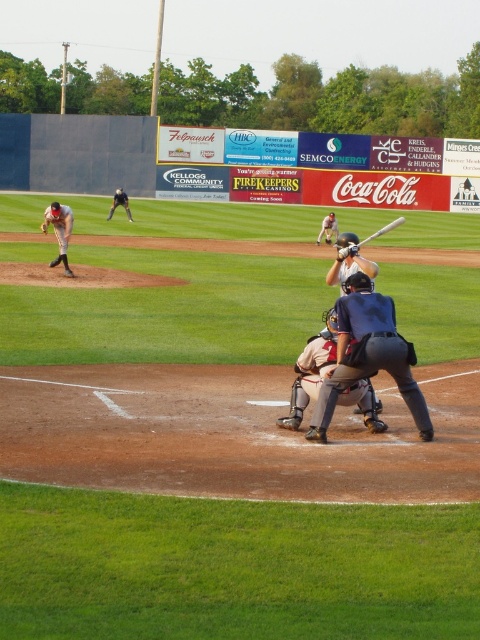
Does white leather catcher at center come in front of white uniform at left?

Yes, white leather catcher at center is in front of white uniform at left.

Locate an element on the screen. The width and height of the screenshot is (480, 640). white leather catcher at center is located at coordinates (312, 371).

The height and width of the screenshot is (640, 480). I want to click on white leather catcher at center, so click(312, 371).

Between point (331, 321) and point (350, 244), which one is positioned behind?

The point (350, 244) is more distant.

Consider the image. Which is more to the left, white leather catcher at center or wooden baseball bat at center?

Positioned to the left is white leather catcher at center.

What do you see at coordinates (312, 371) in the screenshot?
I see `white leather catcher at center` at bounding box center [312, 371].

Identify the location of white leather catcher at center. The height and width of the screenshot is (640, 480). (312, 371).

Can you confirm if white leather catcher at center is thinner than matte gray helmet at center?

No, white leather catcher at center is not thinner than matte gray helmet at center.

This screenshot has width=480, height=640. In order to click on white leather catcher at center in this screenshot , I will do `click(312, 371)`.

Is point (334, 356) in front of point (336, 225)?

Yes, it is.

In order to click on white leather catcher at center in this screenshot , I will do `click(312, 371)`.